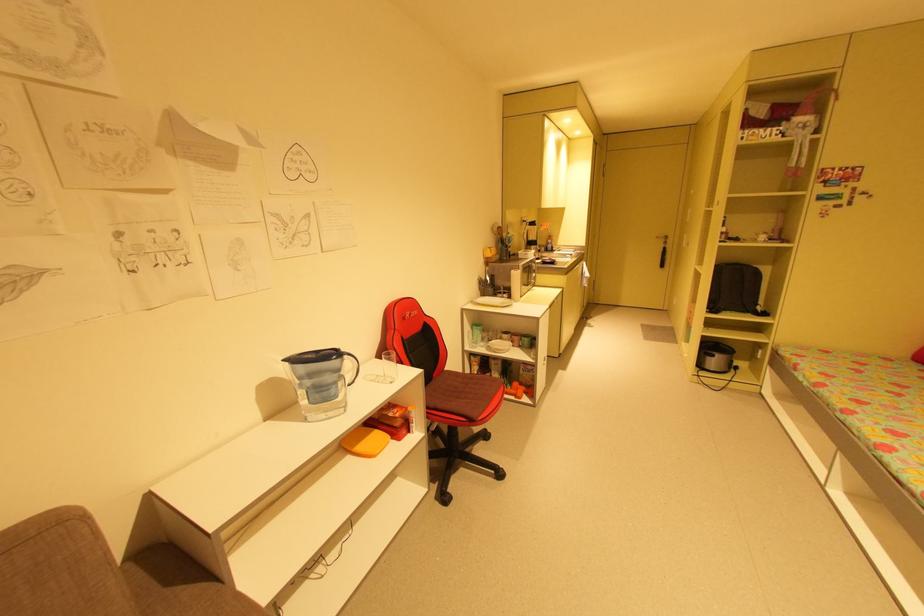
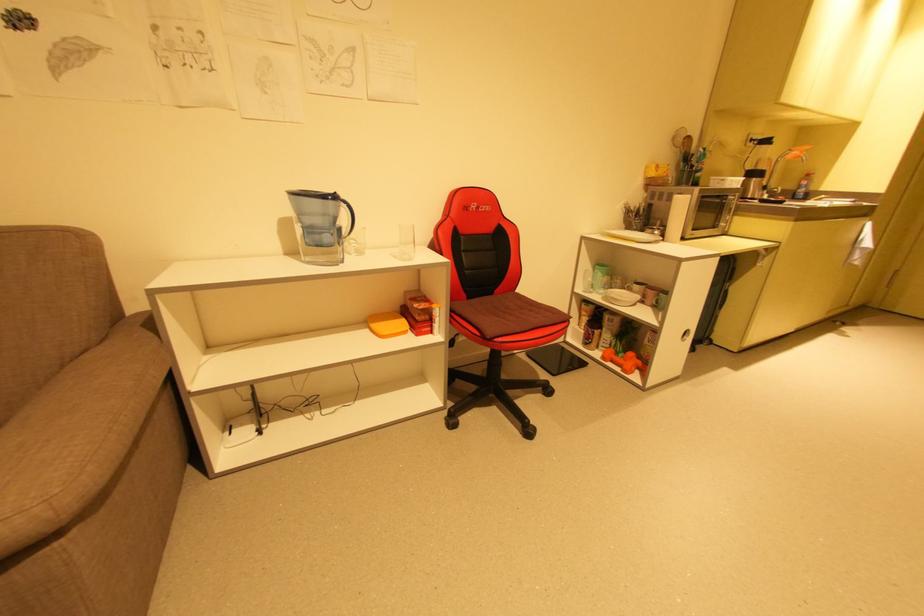
The point at (494, 342) is marked in the first image. Where is the corresponding point in the second image?

(616, 290)